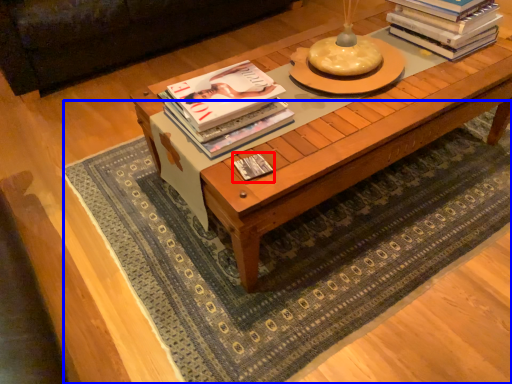
Question: Which object is closer to the camera taking this photo, book (highlighted by a red box) or mat (highlighted by a blue box)?

Choices:
 (A) book
 (B) mat

Answer: (B)